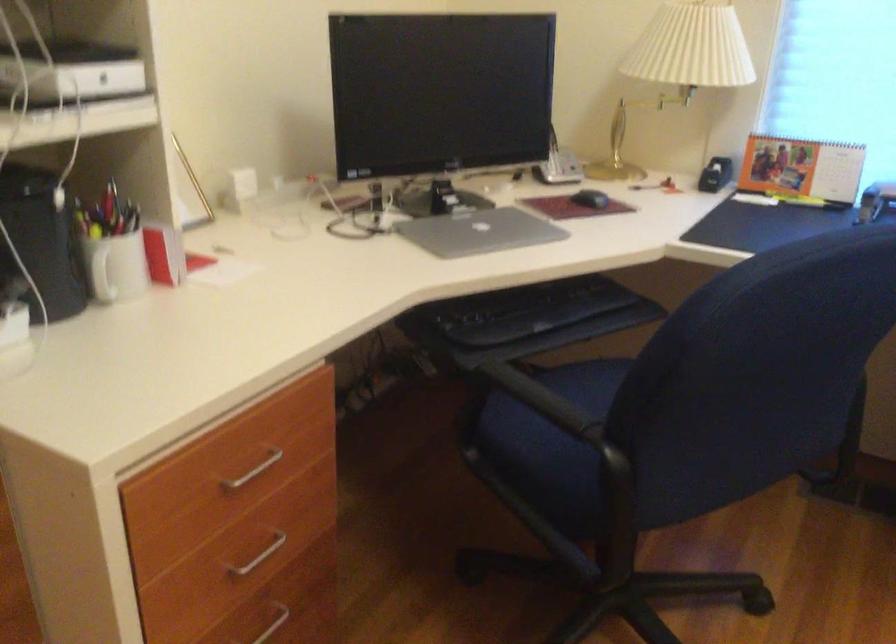
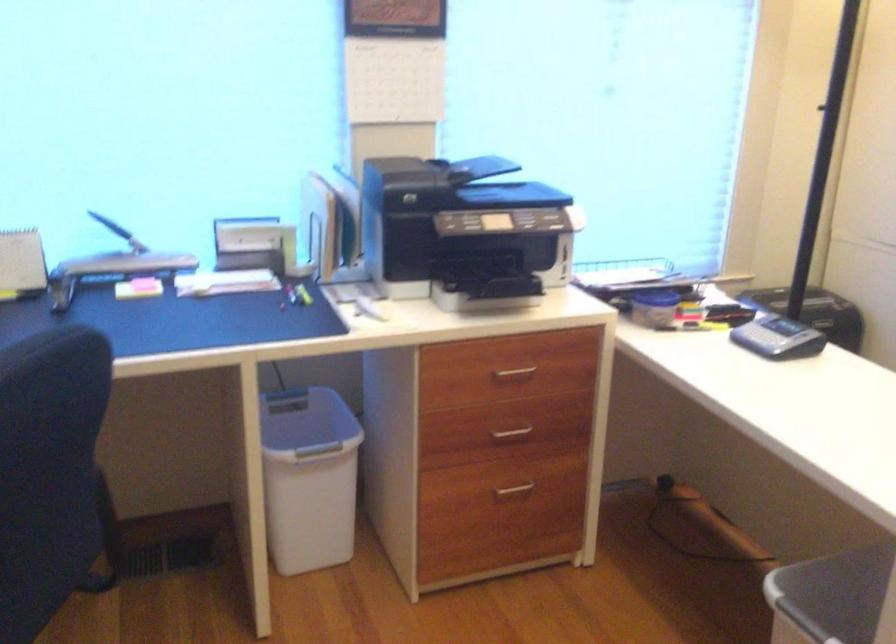
Question: The images are taken continuously from a first-person perspective. In which direction is your viewpoint rotating?

Choices:
 (A) Left
 (B) Right
 (C) Up
 (D) Down

Answer: (B)